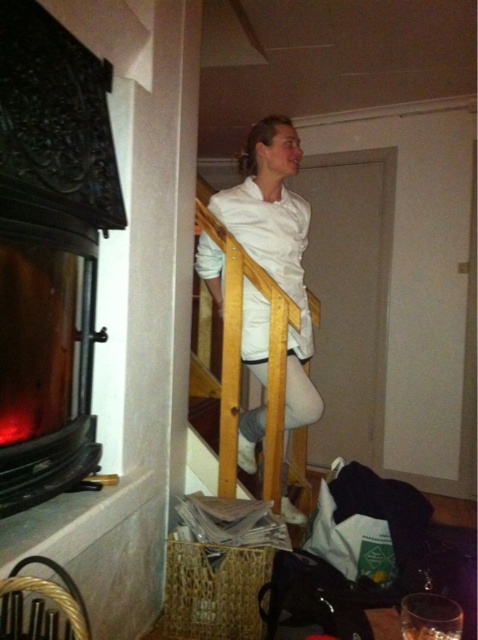
You are designing a room layout and need to place a new sofa that is 2 meters wide. You see the matte black fireplace at left and the white matte shirt at center. Which object has a smaller width and can accommodate the sofa placement next to it?

The matte black fireplace at left has a smaller width than the white matte shirt at center, so it can accommodate the sofa placement next to it.

You are standing at the bottom of the staircase and want to place a decorative item on the matte black fireplace at left. Based on the coordinates provided, can you determine the direction you should move to reach the fireplace?

The matte black fireplace at left is located at coordinates point (45, 360). Since you are at the bottom of the staircase, you should move towards the left direction to reach the fireplace.

You are standing at the bottom of the staircase and want to hand a gift to the person wearing the white matte shirt at center. Which direction should you move towards to reach them while avoiding the matte black fireplace at left?

The matte black fireplace at left is located below the white matte shirt at center, so you should move upwards along the staircase towards the white matte shirt at center to avoid the fireplace.